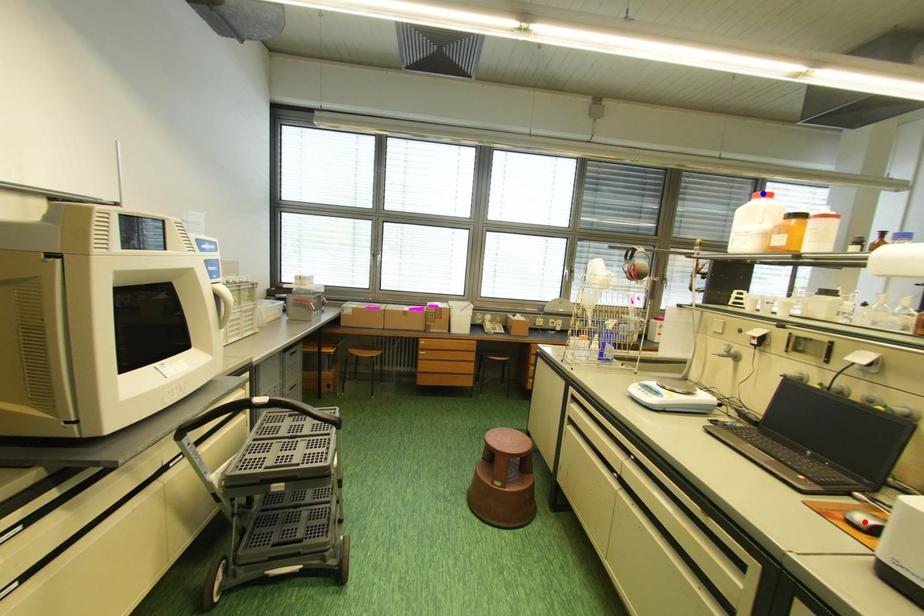
Question: In the image, two points are highlighted. Which point is nearer to the camera? Reply with the corresponding letter.

Choices:
 (A) blue point
 (B) red point

Answer: (B)